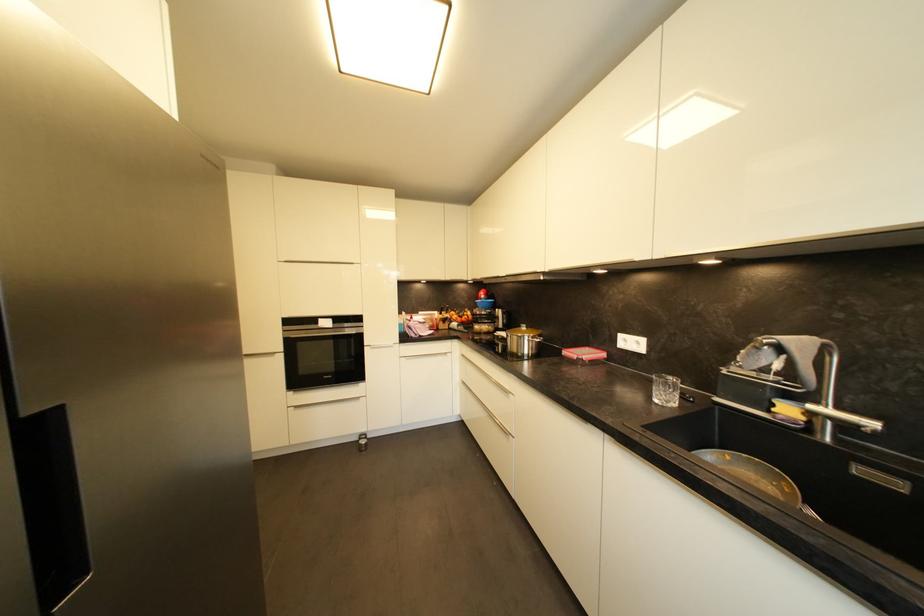
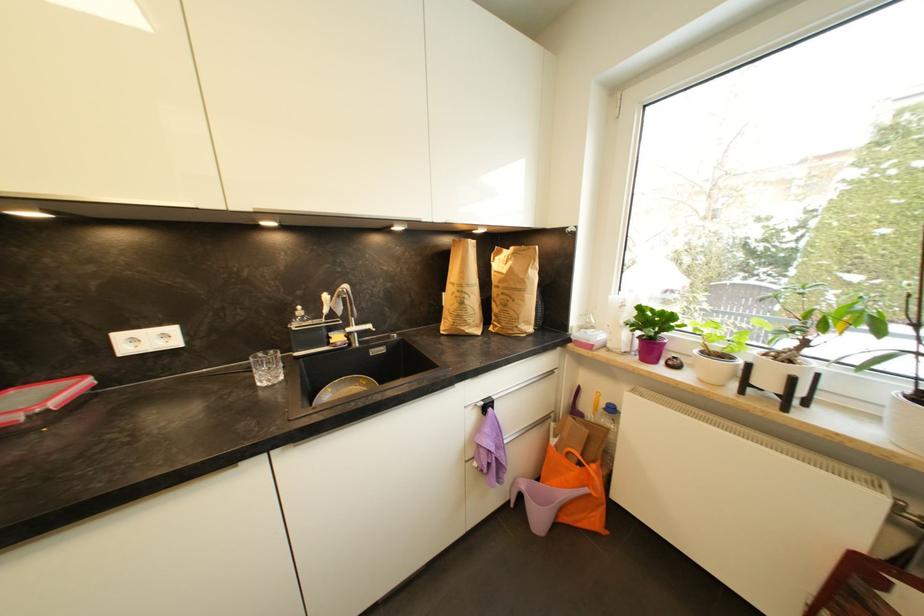
Question: The camera is either moving clockwise (left) or counter-clockwise (right) around the object. The first image is from the beginning of the video and the second image is from the end. Is the camera moving left or right when shooting the video?

Choices:
 (A) Left
 (B) Right

Answer: (A)